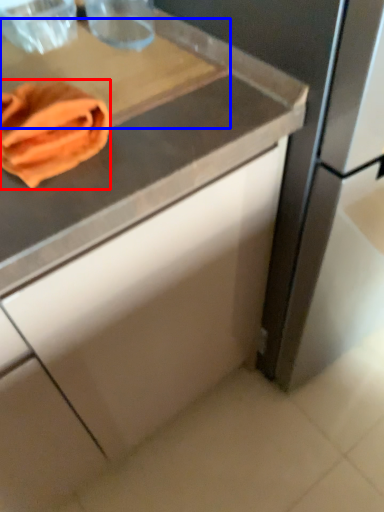
Question: Which of the following is the farthest to the observer, material (highlighted by a red box) or cutting board (highlighted by a blue box)?

Choices:
 (A) material
 (B) cutting board

Answer: (B)